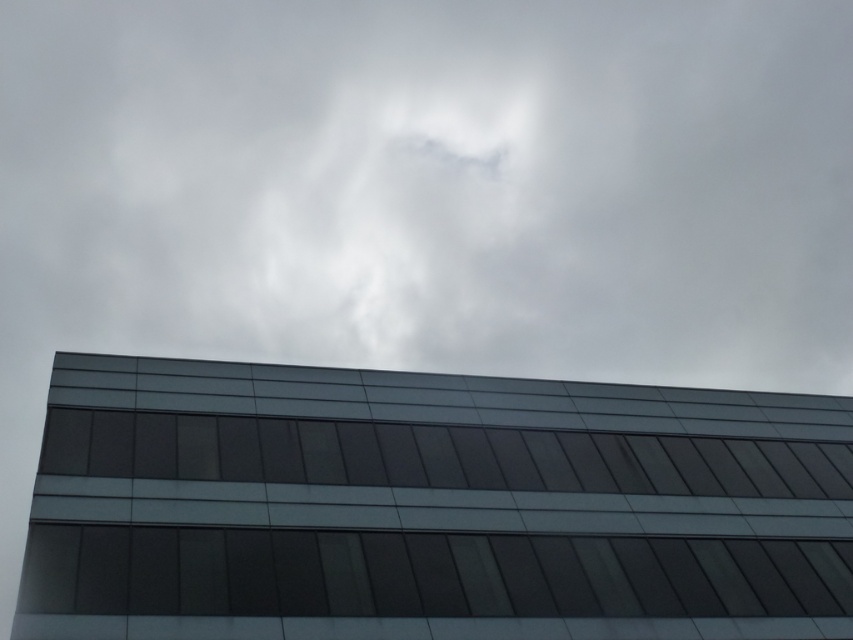
You are a drone operator tasked with capturing aerial footage of the modern building. Your drone has a maximum flight range of 250 meters. You notice a white fluffy cloud at upper center in the scene. Can your drone safely fly to the building without getting too close to the cloud?

The white fluffy cloud at upper center is 260.13 meters from camera, which is beyond the drone maximum flight range of 250 meters. Therefore, the drone can safely fly to the building without getting too close to the cloud.

You are an architect evaluating the building facade. Which window, the transparent glass window at bottom or the dark glass window at center, allows more natural light into the building?

The transparent glass window at bottom allows more natural light into the building than the dark glass window at center because transparent glass typically allows more light transmission compared to dark glass.

You are standing at the entrance of the modern building and see two points marked on the facade. The first point is located at coordinates point (544, 216) and the second at point (700, 476). If you walk towards the building, which point will appear closer to you?

Point (544, 216) is behind point (700, 476), so when you walk towards the building, point (700, 476) will appear closer to you.